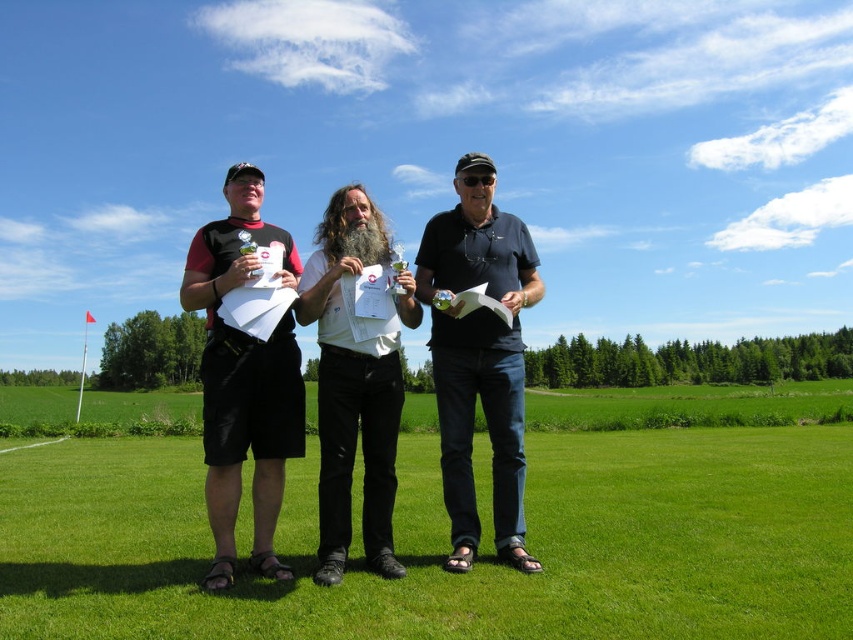
Does point (206, 284) lie behind point (322, 445)?

Yes, point (206, 284) is behind point (322, 445).

Measure the distance from black matte shorts at left to white paper at center.

The distance of black matte shorts at left from white paper at center is 4.58 feet.

Is point (283, 380) closer to viewer compared to point (372, 444)?

No.

This screenshot has height=640, width=853. I want to click on black matte shorts at left, so click(x=244, y=378).

Is green grass at center above white paper at center?

Actually, green grass at center is below white paper at center.

Which is behind, point (28, 506) or point (325, 566)?

The point (28, 506) is behind.

Is point (782, 529) more distant than point (355, 368)?

Yes, point (782, 529) is farther from viewer.

Locate an element on the screen. This screenshot has width=853, height=640. green grass at center is located at coordinates (482, 534).

In the scene shown: Is green grass at center below dark blue polo shirt at center?

Yes.

Describe the element at coordinates (482, 534) in the screenshot. Image resolution: width=853 pixels, height=640 pixels. I see `green grass at center` at that location.

Who is more forward, (772, 444) or (479, 374)?

Positioned in front is point (479, 374).

Find the location of a particular element. The image size is (853, 640). green grass at center is located at coordinates (482, 534).